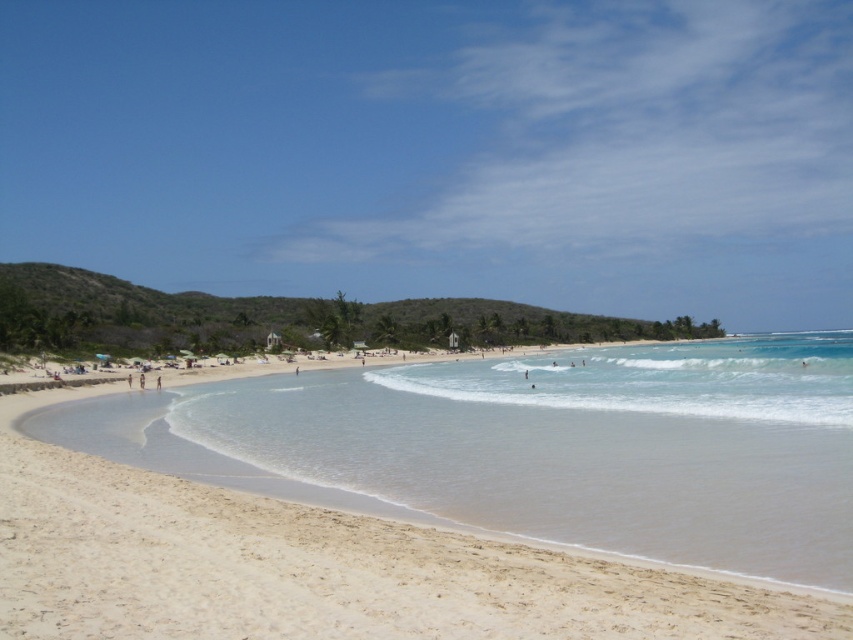
Question: Which point is closer to the camera taking this photo?

Choices:
 (A) (653, 381)
 (B) (540, 516)

Answer: (B)

Question: Where is white sand beach at center located in relation to clear blue water at center in the image?

Choices:
 (A) right
 (B) left

Answer: (B)

Question: Is the position of white sand beach at center less distant than that of clear blue water at center?

Choices:
 (A) no
 (B) yes

Answer: (B)

Question: Does white sand beach at center have a larger size compared to clear blue water at center?

Choices:
 (A) no
 (B) yes

Answer: (A)